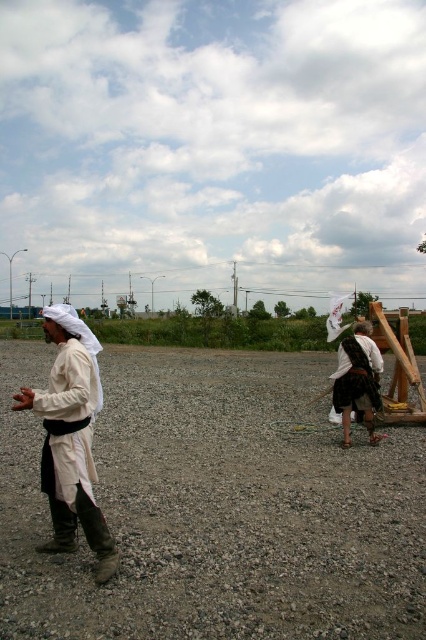
Can you confirm if gray gravel at center is positioned to the right of white cotton robe at left?

Indeed, gray gravel at center is positioned on the right side of white cotton robe at left.

Between point (141, 438) and point (66, 497), which one is positioned behind?

Point (141, 438)

This screenshot has height=640, width=426. I want to click on gray gravel at center, so click(x=216, y=508).

Is point (89, 513) behind point (354, 346)?

No, it is in front of (354, 346).

Can you confirm if white cotton robe at left is smaller than white cotton robe at right?

Yes.

Does point (78, 458) come behind point (356, 388)?

No, it is in front of (356, 388).

Image resolution: width=426 pixels, height=640 pixels. I want to click on white cotton robe at left, so click(x=71, y=436).

Does gray gravel at center have a larger size compared to white cotton robe at right?

Indeed, gray gravel at center has a larger size compared to white cotton robe at right.

Can you confirm if gray gravel at center is positioned above white cotton robe at right?

Incorrect, gray gravel at center is not positioned above white cotton robe at right.

I want to click on gray gravel at center, so click(216, 508).